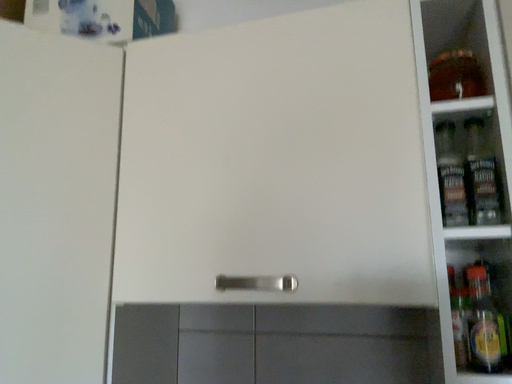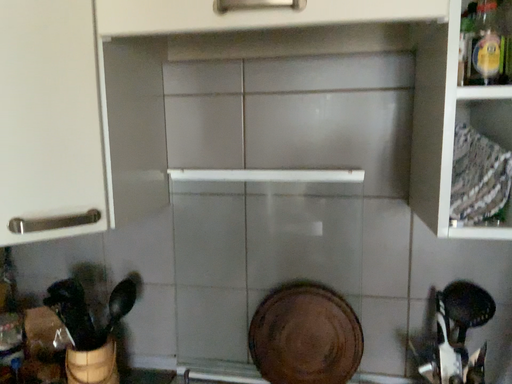
Question: How did the camera likely rotate when shooting the video?

Choices:
 (A) rotated upward
 (B) rotated downward

Answer: (B)